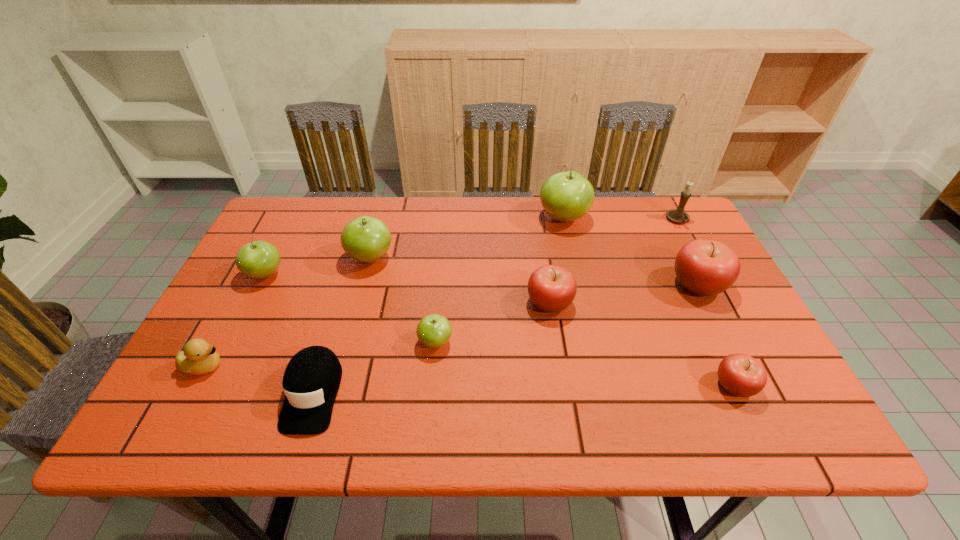
Identify which object is located as the sixth nearest to the duckling. Please provide its 2D coordinates. Your answer should be formatted as a tuple, i.e. [(x, y)], where the tuple contains the x and y coordinates of a point satisfying the conditions above.

[(566, 196)]

Image resolution: width=960 pixels, height=540 pixels. I want to click on the fourth closest apple to the smallest red apple, so click(434, 330).

This screenshot has height=540, width=960. I want to click on the second closest apple to the cap, so click(259, 259).

Identify the location of green apple that stands as the second closest to the leftmost apple. The width and height of the screenshot is (960, 540). 434,330.

Identify which green apple is the second nearest to the second smallest green apple. Please provide its 2D coordinates. Your answer should be formatted as a tuple, i.e. [(x, y)], where the tuple contains the x and y coordinates of a point satisfying the conditions above.

[(434, 330)]

Find the location of `the third closest red apple to the duckling`. the third closest red apple to the duckling is located at coordinates (705, 267).

Identify which red apple is the closest to the third green apple from right to left. Please provide its 2D coordinates. Your answer should be formatted as a tuple, i.e. [(x, y)], where the tuple contains the x and y coordinates of a point satisfying the conditions above.

[(551, 288)]

Find the location of a particular element. The height and width of the screenshot is (540, 960). vacant space that satisfies the following two spatial constraints: 1. on the front side of the leftmost apple; 2. on the left side of the second green apple from right to left is located at coordinates (231, 342).